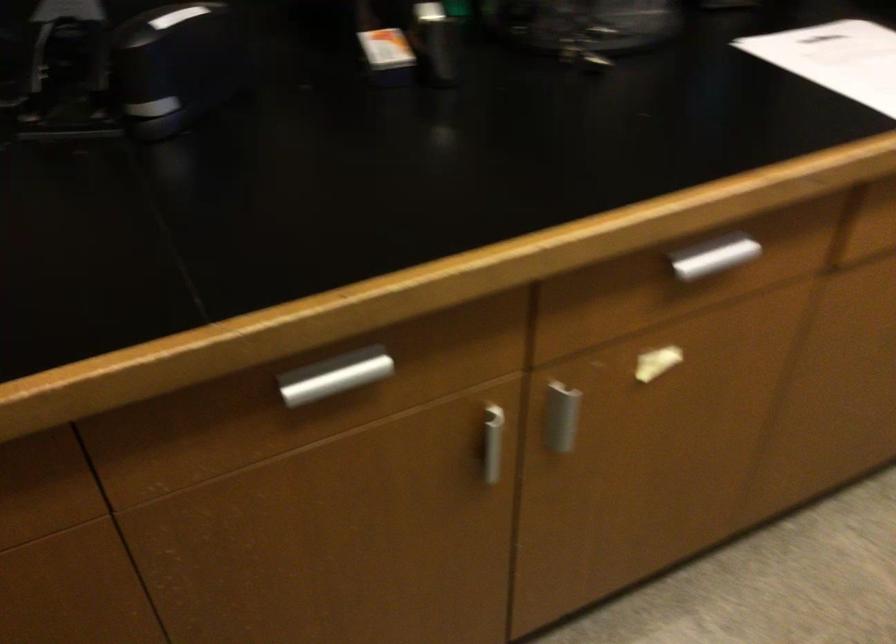
Find where to lift the white paper sheet. Please return your answer as a coordinate pair (x, y).

(836, 59)